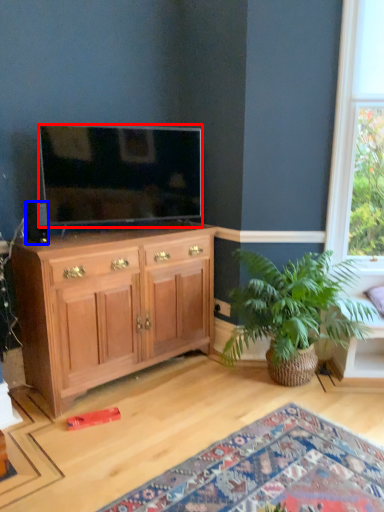
Question: Among these objects, which one is farthest to the camera, television (highlighted by a red box) or loudspeaker (highlighted by a blue box)?

Choices:
 (A) television
 (B) loudspeaker

Answer: (A)